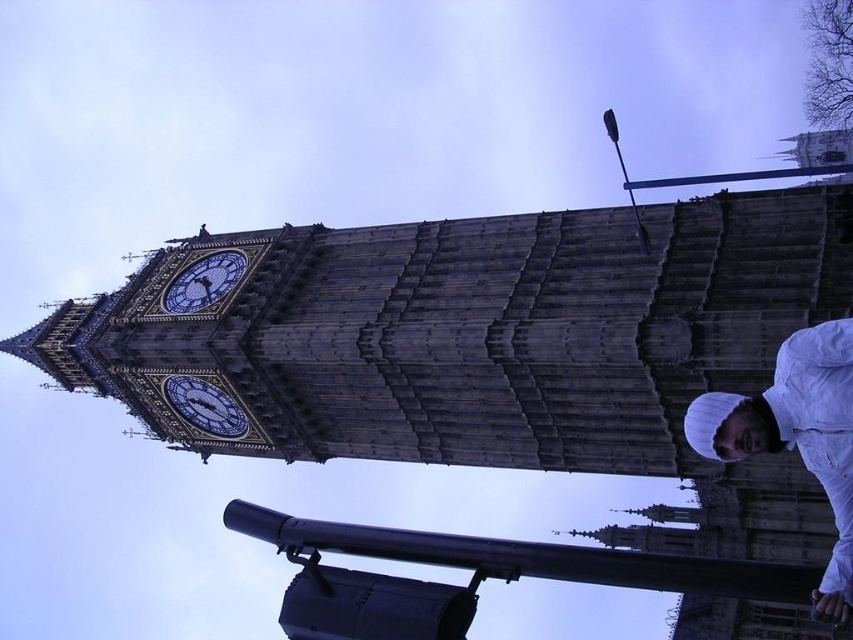
Can you confirm if stone clock tower at center is positioned to the left of blue painted stone clock at upper center?

No, stone clock tower at center is not to the left of blue painted stone clock at upper center.

Does stone clock tower at center have a greater height compared to blue painted stone clock at upper center?

Yes, stone clock tower at center is taller than blue painted stone clock at upper center.

You are a GUI agent. You are given a task and a screenshot of the screen. Output one action in this format:
    pyautogui.click(x=<x>, y=<y>)
    Task: Click on the stone clock tower at center
    The image size is (853, 640).
    Given the screenshot: What is the action you would take?
    pyautogui.click(x=473, y=332)

Based on the photo, which of these two, black metal pole at lower center or blue painted stone clock at upper center, stands shorter?

Standing shorter between the two is blue painted stone clock at upper center.

What do you see at coordinates (529, 557) in the screenshot? Image resolution: width=853 pixels, height=640 pixels. I see `black metal pole at lower center` at bounding box center [529, 557].

Locate an element on the screen. black metal pole at lower center is located at coordinates tap(529, 557).

Between white matte jacket at lower right and blue painted stone clock at upper center, which one is positioned lower?

Positioned lower is white matte jacket at lower right.

Which is more to the right, white matte jacket at lower right or blue painted stone clock at upper center?

white matte jacket at lower right is more to the right.

Is point (830, 465) positioned behind point (216, 289)?

That is False.

Image resolution: width=853 pixels, height=640 pixels. In order to click on white matte jacket at lower right in this screenshot , I will do `click(796, 435)`.